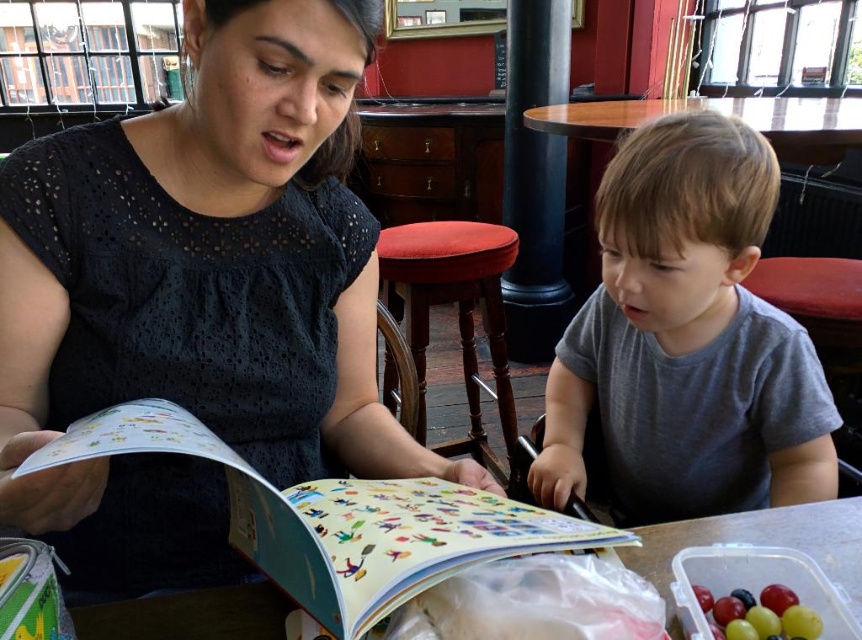
You are a photographer standing in the middle of the room. You want to take a photo of the gray cotton shirt at center and the black polished wood pillar at center. Which object should you focus on first if you want to capture both in the same frame without moving the camera?

The gray cotton shirt at center is located below the black polished wood pillar at center. Since the pillar is above the shirt, you can focus on the shirt first and ensure the pillar is within the frame by adjusting the camera angle slightly downward.

You are a delivery person standing at the camera position. You need to place a small package on the table at point (822, 420). The package requires a minimum of 1 meter of space from the camera to ensure it doesn t get knocked over. Can you safely place the package there?

The distance between the camera and point (822, 420) is 94.74 centimeters. Since this is less than the required 1 meter, placing the package there would not be safe as it is too close to the camera.

You are a customer entering the cafe and want to sit down at the white plastic table at center. However, there is a matte black dress at center in your way. Is the dress on top of the table or hanging from a chair?

The matte black dress at center is above white plastic table at center, so it is likely on top of the table rather than hanging from a chair.